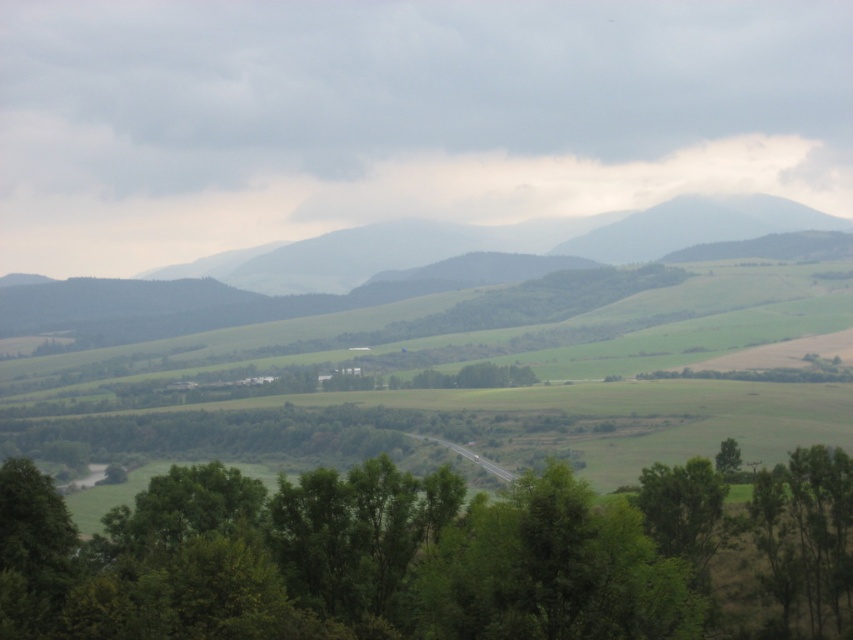
You are a hiker standing at the edge of the green leafy tree at center and want to reach the green grassy hill at center. Which path would require less effort based on their sizes?

The green leafy tree at center is thinner than the green grassy hill at center, so the path to the green leafy tree at center would require less effort since it is narrower and likely easier to navigate around.